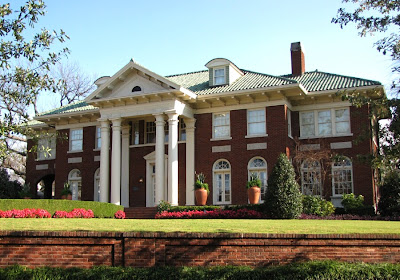
Locate an element on the screen. 1 brick wall is located at coordinates (45, 250).